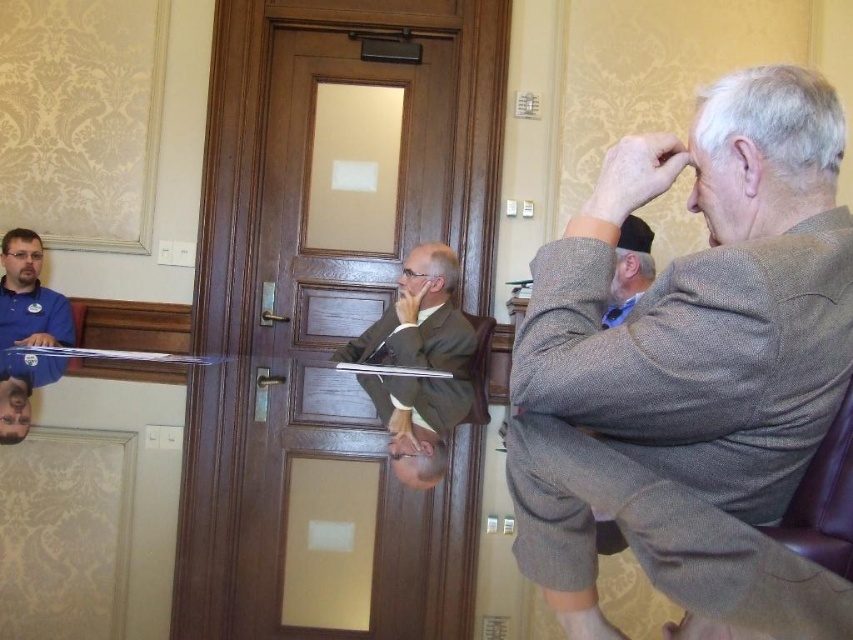
Is matte brown suit at center bigger than matte blue shirt at left?

Actually, matte brown suit at center might be smaller than matte blue shirt at left.

Does matte brown suit at center have a greater height compared to matte blue shirt at left?

In fact, matte brown suit at center may be shorter than matte blue shirt at left.

Between point (396, 449) and point (62, 312), which one is positioned behind?

The point (62, 312) is behind.

You are a GUI agent. You are given a task and a screenshot of the screen. Output one action in this format:
    pyautogui.click(x=<x>, y=<y>)
    Task: Click on the matte brown suit at center
    This screenshot has height=640, width=853.
    Given the screenshot: What is the action you would take?
    419,317

Which of these two, brown woolen suit at upper right or brown leather chair at lower right, stands taller?

Standing taller between the two is brown woolen suit at upper right.

Describe the element at coordinates (693, 372) in the screenshot. I see `brown woolen suit at upper right` at that location.

Is point (799, 614) positioned in front of point (827, 448)?

That is True.

What are the coordinates of `brown woolen suit at upper right` in the screenshot? It's located at (693, 372).

Between wooden door at center and blue fabric cap at upper right, which one appears on the left side from the viewer's perspective?

wooden door at center

What do you see at coordinates (328, 305) in the screenshot? I see `wooden door at center` at bounding box center [328, 305].

Locate an element on the screen. wooden door at center is located at coordinates (328, 305).